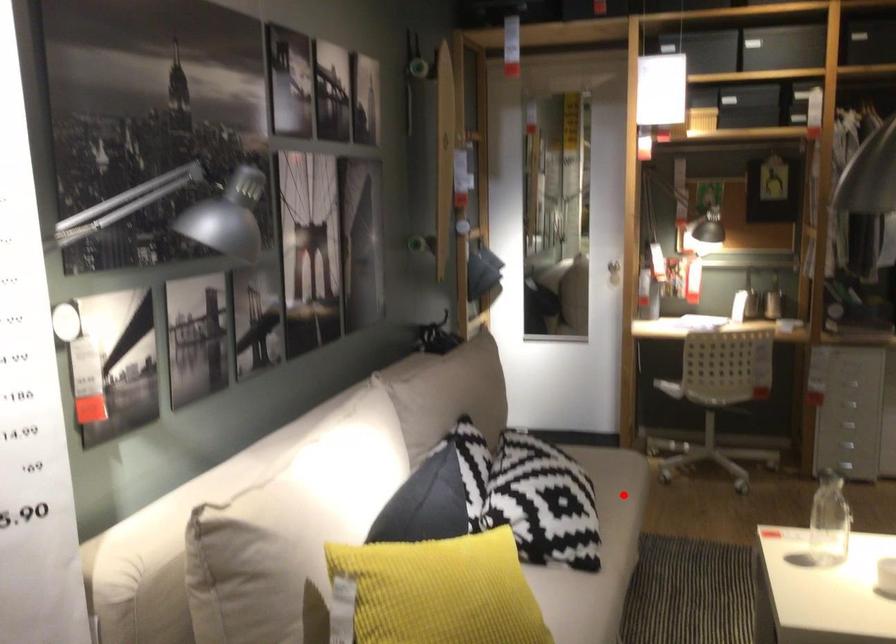
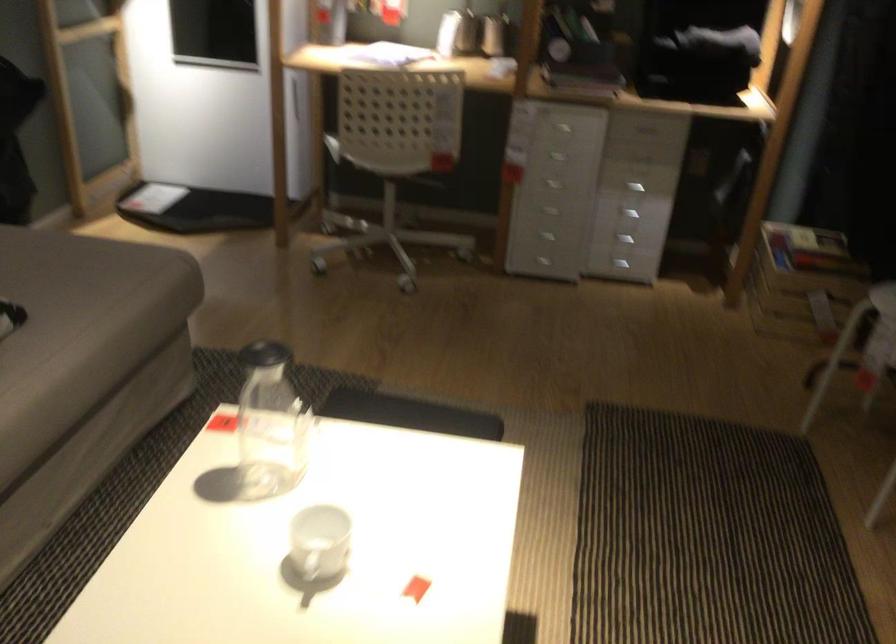
Question: I am providing you with two images of the same scene from different viewpoints. Image1 has a red point marked. In image2, the corresponding 3D location appears at what relative position? Reply with the corresponding letter.

Choices:
 (A) Closer
 (B) Farther

Answer: (A)